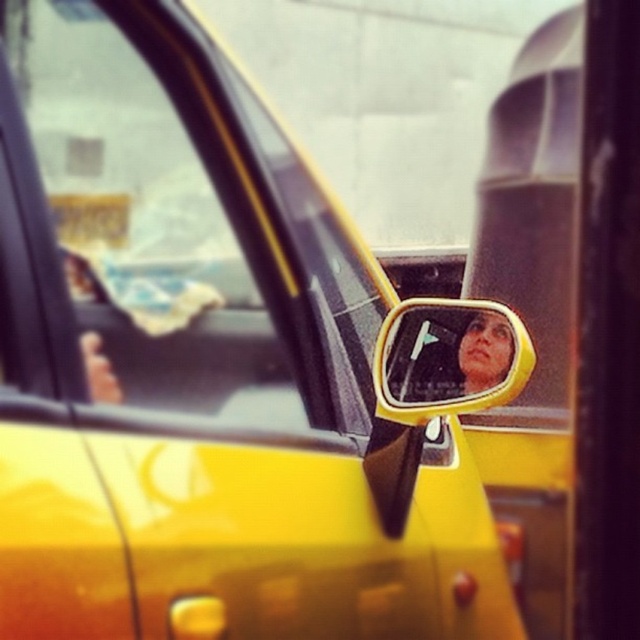
Question: Does transparent glass car window at upper left appear under yellow plastic mirror at center?

Choices:
 (A) no
 (B) yes

Answer: (A)

Question: Does transparent glass car window at upper left appear on the left side of yellow plastic mirror at center?

Choices:
 (A) yes
 (B) no

Answer: (A)

Question: Which point is farther to the camera?

Choices:
 (A) (467, 305)
 (B) (260, 381)

Answer: (A)

Question: Which point is closer to the camera?

Choices:
 (A) transparent glass car window at upper left
 (B) yellow plastic mirror at center

Answer: (A)

Question: Among these objects, which one is farthest from the camera?

Choices:
 (A) transparent glass car window at upper left
 (B) yellow plastic mirror at center

Answer: (B)

Question: Does transparent glass car window at upper left have a smaller size compared to yellow plastic mirror at center?

Choices:
 (A) yes
 (B) no

Answer: (B)